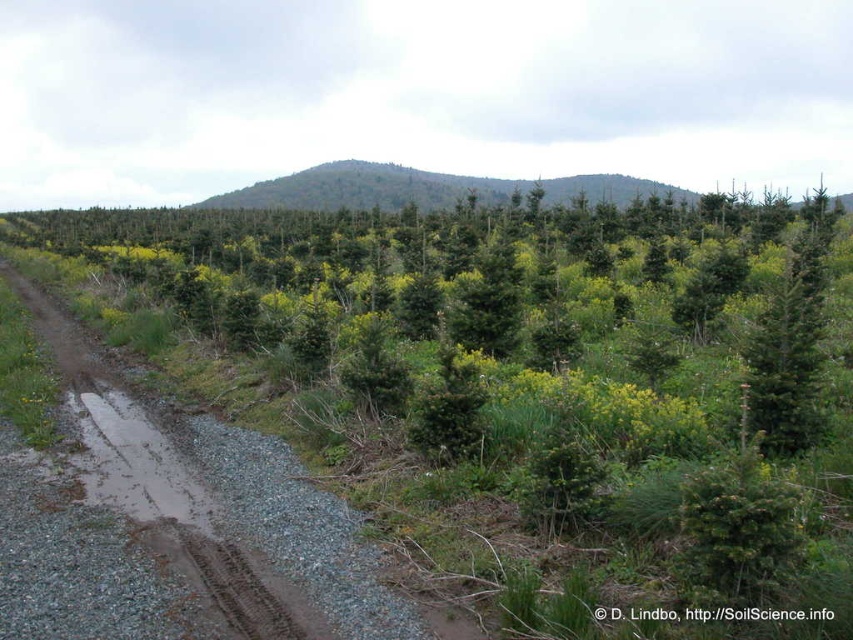
Is brown gravel road at left taller than green forested mountain at center?

No, brown gravel road at left is not taller than green forested mountain at center.

Is brown gravel road at left positioned before green forested mountain at center?

Yes, it is in front of green forested mountain at center.

Does point (210, 477) come closer to viewer compared to point (451, 198)?

That is True.

Locate an element on the screen. This screenshot has width=853, height=640. brown gravel road at left is located at coordinates (236, 497).